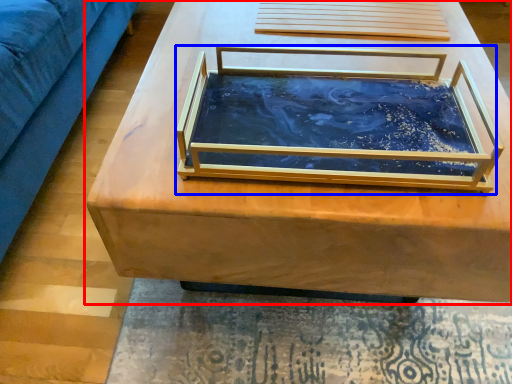
Question: Which of the following is the farthest to the observer, table (highlighted by a red box) or glass box (highlighted by a blue box)?

Choices:
 (A) table
 (B) glass box

Answer: (A)